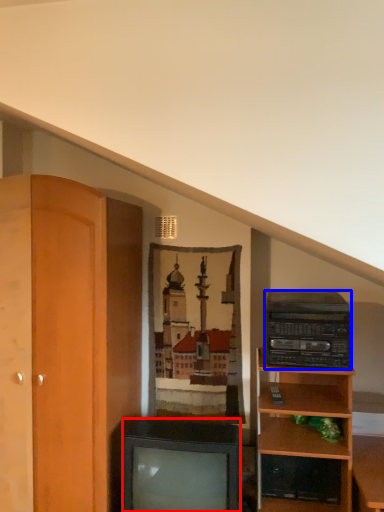
Question: Which object appears farthest to the camera in this image, television (highlighted by a red box) or stereo (highlighted by a blue box)?

Choices:
 (A) television
 (B) stereo

Answer: (B)